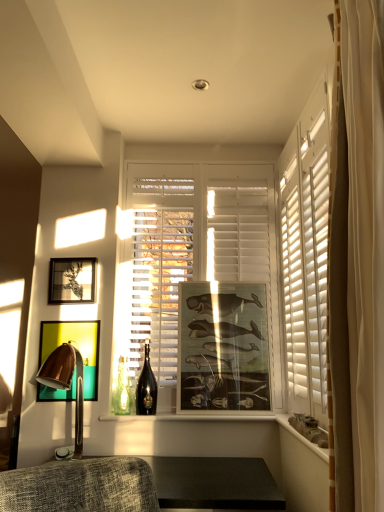
Question: From the image's perspective, is copper metallic table lamp at left located beneath matte wooden picture frame at center, which appears as the first picture frame when viewed from the right?

Choices:
 (A) no
 (B) yes

Answer: (B)

Question: Is copper metallic table lamp at left behind matte wooden picture frame at center, which appears as the first picture frame when viewed from the right?

Choices:
 (A) no
 (B) yes

Answer: (A)

Question: Is copper metallic table lamp at left smaller than matte wooden picture frame at center, which appears as the first picture frame when viewed from the right?

Choices:
 (A) no
 (B) yes

Answer: (B)

Question: Considering the relative positions of copper metallic table lamp at left and matte wooden picture frame at center, which appears as the first picture frame when viewed from the right, in the image provided, is copper metallic table lamp at left to the right of matte wooden picture frame at center, which appears as the first picture frame when viewed from the right, from the viewer's perspective?

Choices:
 (A) yes
 (B) no

Answer: (B)

Question: Is copper metallic table lamp at left outside matte wooden picture frame at center, which appears as the first picture frame when viewed from the right?

Choices:
 (A) yes
 (B) no

Answer: (A)

Question: Is point (67, 330) closer or farther from the camera than point (79, 434)?

Choices:
 (A) farther
 (B) closer

Answer: (A)

Question: Is metallic gold picture frame at left, which is counted as the second picture frame, starting from the left, in front of or behind copper metallic table lamp at left in the image?

Choices:
 (A) behind
 (B) front

Answer: (A)

Question: Is metallic gold picture frame at left, which ranks as the 2th picture frame in right-to-left order, to the left or to the right of copper metallic table lamp at left in the image?

Choices:
 (A) right
 (B) left

Answer: (B)

Question: From the image's perspective, is metallic gold picture frame at left, which is counted as the second picture frame, starting from the left, positioned above or below copper metallic table lamp at left?

Choices:
 (A) above
 (B) below

Answer: (A)

Question: In the image, is wooden ledge at lower right on the left side or the right side of metallic gold picture frame at left, which is counted as the second picture frame, starting from the left?

Choices:
 (A) left
 (B) right

Answer: (B)

Question: Considering the positions of wooden ledge at lower right and metallic gold picture frame at left, which is counted as the second picture frame, starting from the left, in the image, is wooden ledge at lower right bigger or smaller than metallic gold picture frame at left, which is counted as the second picture frame, starting from the left,?

Choices:
 (A) big
 (B) small

Answer: (B)

Question: Considering the positions of wooden ledge at lower right and metallic gold picture frame at left, which ranks as the 2th picture frame in right-to-left order, in the image, is wooden ledge at lower right taller or shorter than metallic gold picture frame at left, which ranks as the 2th picture frame in right-to-left order,?

Choices:
 (A) tall
 (B) short

Answer: (B)

Question: From a real-world perspective, is wooden ledge at lower right physically located above or below metallic gold picture frame at left, which ranks as the 2th picture frame in right-to-left order?

Choices:
 (A) above
 (B) below

Answer: (B)

Question: Considering the positions of wooden ledge at lower right and matte black picture frame at upper left, the 3th picture frame in the right-to-left sequence, in the image, is wooden ledge at lower right wider or thinner than matte black picture frame at upper left, the 3th picture frame in the right-to-left sequence,?

Choices:
 (A) thin
 (B) wide

Answer: (B)

Question: From their relative heights in the image, would you say wooden ledge at lower right is taller or shorter than matte black picture frame at upper left, arranged as the 1th picture frame when viewed from the left?

Choices:
 (A) tall
 (B) short

Answer: (B)